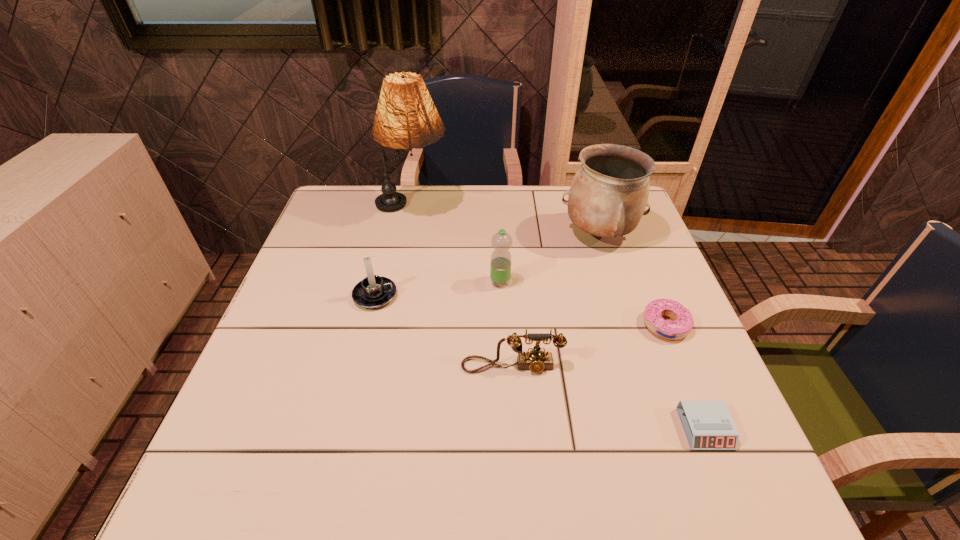
Where is `lampshade`? lampshade is located at coordinates (406, 117).

Identify the location of urn. Image resolution: width=960 pixels, height=540 pixels. (609, 193).

At what (x,y) coordinates should I click in order to perform the action: click on water bottle. Please return your answer as a coordinate pair (x, y). The image size is (960, 540). Looking at the image, I should click on (500, 267).

Locate an element on the screen. This screenshot has width=960, height=540. candle holder is located at coordinates (374, 291).

The image size is (960, 540). Identify the location of the fifth tallest object. (536, 360).

Locate an element on the screen. the sixth farthest object is located at coordinates (536, 360).

Locate an element on the screen. This screenshot has width=960, height=540. the second shortest object is located at coordinates (683, 322).

This screenshot has height=540, width=960. What are the coordinates of `the shortest object` in the screenshot? It's located at (708, 425).

Identify the location of the nearest object. (708, 425).

Locate an element on the screen. This screenshot has height=540, width=960. vacant space located on the front-facing side of the lampshade is located at coordinates (554, 208).